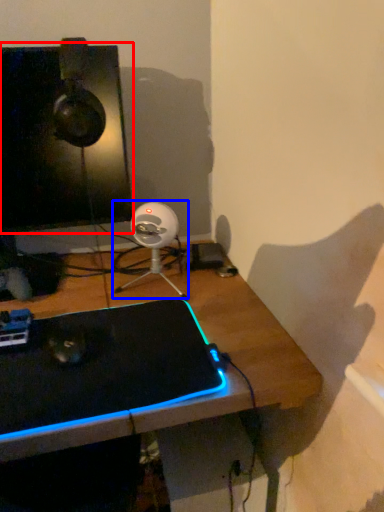
Question: Which object appears closest to the camera in this image, computer monitor (highlighted by a red box) or fan (highlighted by a blue box)?

Choices:
 (A) computer monitor
 (B) fan

Answer: (A)